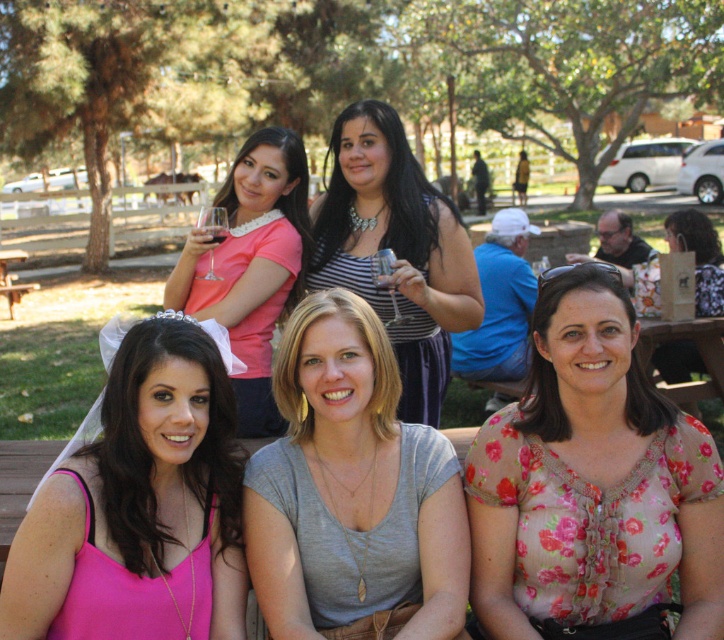
Can you confirm if floral fabric dress at lower right is taller than brown wooden picnic table at lower left?

Yes, floral fabric dress at lower right is taller than brown wooden picnic table at lower left.

Between floral fabric dress at lower right and brown wooden picnic table at lower left, which one appears on the left side from the viewer's perspective?

brown wooden picnic table at lower left is more to the left.

Describe the element at coordinates (699, 257) in the screenshot. I see `floral fabric dress at lower right` at that location.

The width and height of the screenshot is (724, 640). Identify the location of floral fabric dress at lower right. (699, 257).

Is pink fabric dress at upper left smaller than brown wooden picnic table at lower left?

Correct, pink fabric dress at upper left occupies less space than brown wooden picnic table at lower left.

Identify the location of pink fabric dress at upper left. (251, 264).

This screenshot has width=724, height=640. What are the coordinates of `pink fabric dress at upper left` in the screenshot? It's located at (251, 264).

Between striped fabric dress at center and floral fabric dress at lower right, which one is positioned lower?

striped fabric dress at center is lower down.

Who is more forward, (391, 305) or (720, 252)?

Point (391, 305)

Between point (400, 132) and point (681, 243), which one is positioned in front?

Point (400, 132) is in front.

The image size is (724, 640). I want to click on striped fabric dress at center, so click(x=395, y=250).